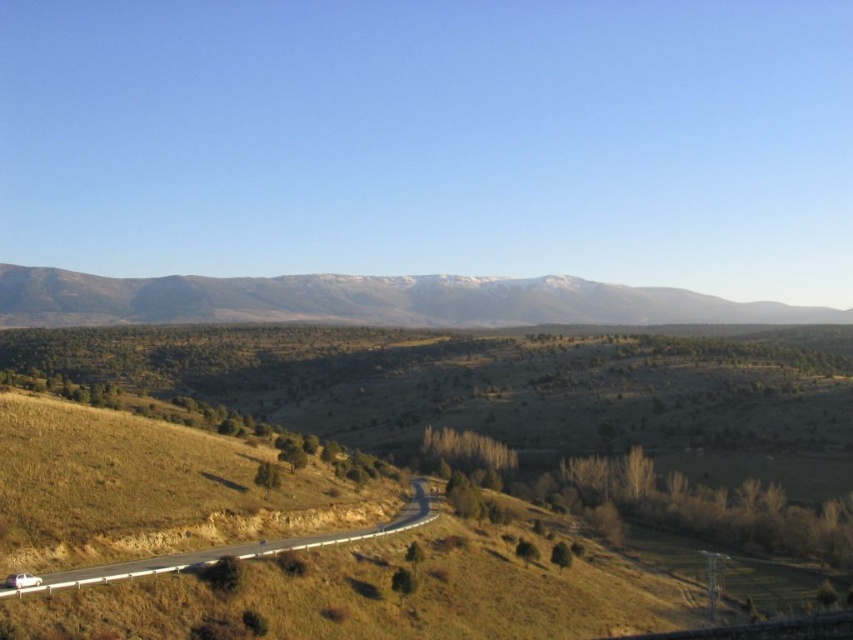
You are standing at the starting point of the winding road in the image and want to reach a destination. You have two options to choose from, either going towards point (560, 292) or point (186, 566). Which point is closer to you?

Point (186, 566) is closer to you since point (560, 292) is further away from the camera, meaning it is farther in the scene.

You are a hiker planning to take the asphalt road at lower left towards the snowy rock mountain range at upper center. Based on the scene, in which direction should you head to reach the mountains from the road?

To reach the snowy rock mountain range at upper center from the asphalt road at lower left, you should head towards the right direction since the snowy rock mountain range at upper center is located to the right of the asphalt road at lower left.

You are a hiker planning to take a photo of the snowy rock mountain range at upper center and the asphalt road at lower left. Which object should you focus on first if you want to capture both in a single frame without moving the camera?

The snowy rock mountain range at upper center is wider than the asphalt road at lower left, so you should focus on the snowy rock mountain range at upper center first to ensure it fits in the frame.